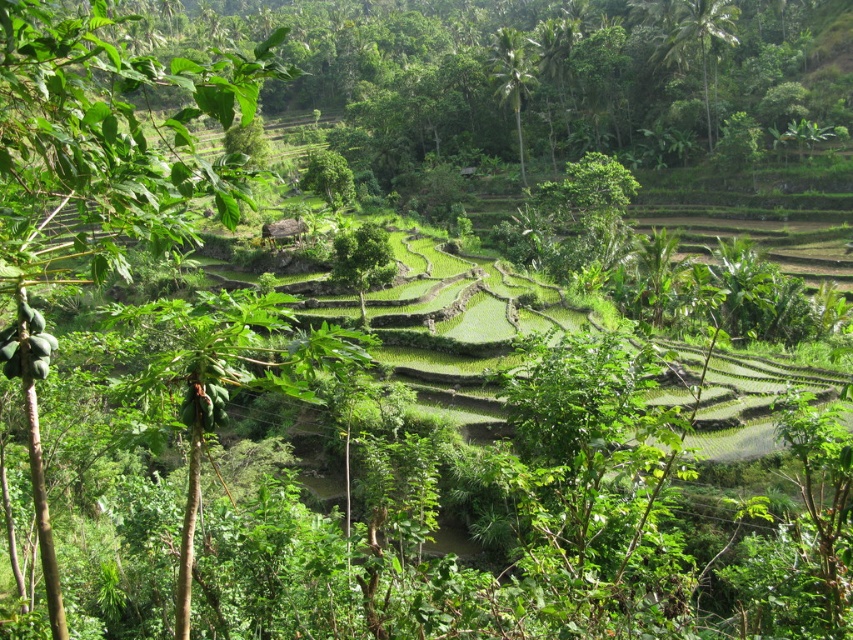
Based on the photo, you are standing in a tropical rice paddy field and see two points marked in the image. The first point is at coordinate point (682,20) and the second is at point (506,32). Which point is closer to you?

Point (506,32) is closer to you because it is less further to the camera than point (682,20).

You are a hiker standing at the bottom of the terraced landscape and looking upwards. Which of the two trees, the green leafy tree at upper right or the green leafy palm at upper center, would appear closer to you?

The green leafy tree at upper right appears closer because the green leafy palm at upper center is positioned behind it.

You are a hiker standing at the bottom of the terraced landscape. You notice two plants ahead of you, the green leafy tree at center and the green leafy palm at upper center. Which of these plants is narrower in width?

The green leafy tree at center is narrower in width compared to the green leafy palm at upper center.